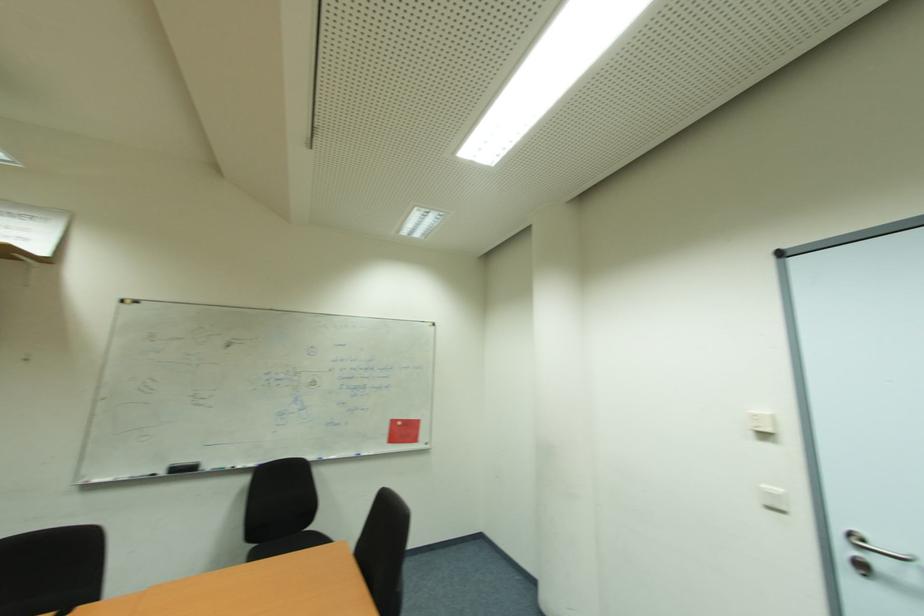
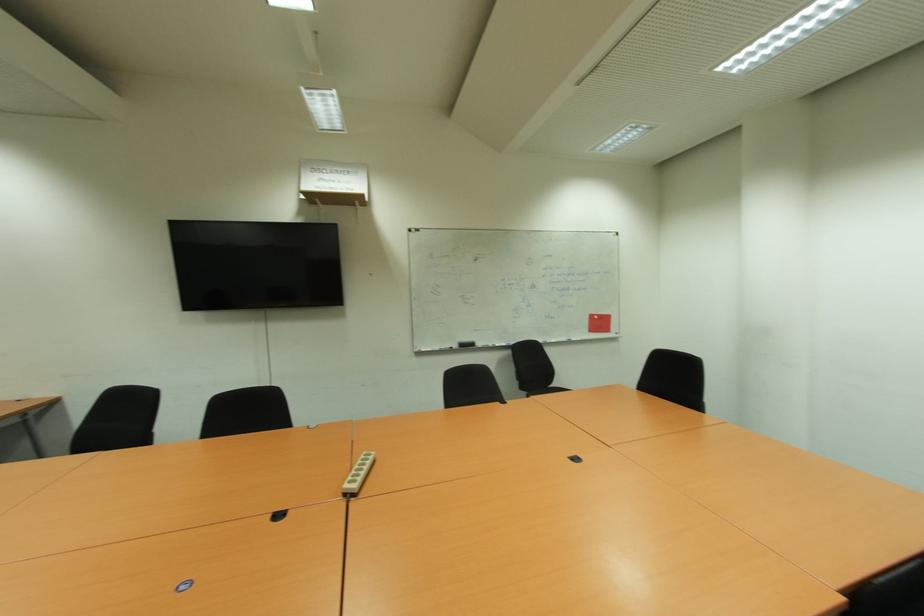
Which direction would the cameraman need to move to produce the second image?

The cameraman walked toward left, backward.